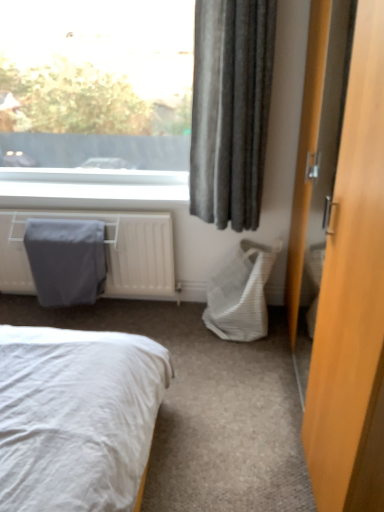
Identify the location of dark grey fabric curtain at upper right. The width and height of the screenshot is (384, 512). (231, 109).

Measure the distance between white woven laundry basket at lower right and camera.

white woven laundry basket at lower right and camera are 2.32 meters apart from each other.

What do you see at coordinates (66, 260) in the screenshot? Image resolution: width=384 pixels, height=512 pixels. I see `gray fabric blanket at left` at bounding box center [66, 260].

The image size is (384, 512). What do you see at coordinates (352, 298) in the screenshot? I see `wooden door at right` at bounding box center [352, 298].

At what (x,y) coordinates should I click in order to perform the action: click on dark grey fabric curtain at upper right. Please return your answer as a coordinate pair (x, y). Looking at the image, I should click on (231, 109).

Is dark grey fabric curtain at upper right aimed at wooden door at right?

No, dark grey fabric curtain at upper right is not turned towards wooden door at right.

At what (x,y) coordinates should I click in order to perform the action: click on door in front of the dark grey fabric curtain at upper right. Please return your answer as a coordinate pair (x, y). The width and height of the screenshot is (384, 512). Looking at the image, I should click on (352, 298).

Which object is wider, dark grey fabric curtain at upper right or wooden door at right?

With larger width is wooden door at right.

Which object is positioned more to the right, dark grey fabric curtain at upper right or wooden door at right?

From the viewer's perspective, wooden door at right appears more on the right side.

Considering the positions of objects wooden door at right and dark grey fabric curtain at upper right in the image provided, who is behind, wooden door at right or dark grey fabric curtain at upper right?

dark grey fabric curtain at upper right.

Based on the photo, can you confirm if wooden door at right is bigger than dark grey fabric curtain at upper right?

Correct, wooden door at right is larger in size than dark grey fabric curtain at upper right.

Are wooden door at right and dark grey fabric curtain at upper right beside each other?

They are not placed beside each other.

Consider the image. Is gray fabric blanket at left facing towards wooden door at right?

No, gray fabric blanket at left is not oriented towards wooden door at right.

Which of these two, gray fabric blanket at left or wooden door at right, is thinner?

gray fabric blanket at left is thinner.

From the image's perspective, which is below, gray fabric blanket at left or wooden door at right?

gray fabric blanket at left is shown below in the image.

Looking at the image, does gray fabric blanket at left seem bigger or smaller compared to wooden door at right?

In the image, gray fabric blanket at left appears to be smaller than wooden door at right.

Is point (225, 268) closer to viewer compared to point (352, 131)?

No.

Can you tell me how much white woven laundry basket at lower right and wooden door at right differ in facing direction?

There is a 94.4-degree angle between the facing directions of white woven laundry basket at lower right and wooden door at right.

From a real-world perspective, relative to wooden door at right, is white woven laundry basket at lower right vertically above or below?

white woven laundry basket at lower right is below wooden door at right.

Is the depth of white woven laundry basket at lower right greater than that of wooden door at right?

Yes, it is behind wooden door at right.

What's the angular difference between dark grey fabric curtain at upper right and gray fabric-covered radiator at left's facing directions?

dark grey fabric curtain at upper right and gray fabric-covered radiator at left are facing 0.705 degrees away from each other.

Which object is thinner, dark grey fabric curtain at upper right or gray fabric-covered radiator at left?

dark grey fabric curtain at upper right.

Looking at this image, is dark grey fabric curtain at upper right in front of or behind gray fabric-covered radiator at left in the image?

Visually, dark grey fabric curtain at upper right is located in front of gray fabric-covered radiator at left.

Could you tell me if dark grey fabric curtain at upper right is turned towards gray fabric-covered radiator at left?

No, dark grey fabric curtain at upper right is not facing towards gray fabric-covered radiator at left.

From a real-world perspective, is wooden door at right positioned above or below gray fabric blanket at left?

In terms of real-world spatial position, wooden door at right is above gray fabric blanket at left.

How many degrees apart are the facing directions of wooden door at right and gray fabric blanket at left?

The angle between the facing direction of wooden door at right and the facing direction of gray fabric blanket at left is 92.4 degrees.

Considering the positions of point (365, 35) and point (74, 261), is point (365, 35) closer or farther from the camera than point (74, 261)?

Point (365, 35) is positioned closer to the camera compared to point (74, 261).

Could you tell me if wooden door at right is turned towards gray fabric blanket at left?

Yes, wooden door at right is aimed at gray fabric blanket at left.

Considering the positions of objects wooden door at right and white woven laundry basket at lower right in the image provided, who is behind, wooden door at right or white woven laundry basket at lower right?

white woven laundry basket at lower right is further from the camera.

Is wooden door at right oriented towards white woven laundry basket at lower right?

Yes, wooden door at right faces towards white woven laundry basket at lower right.

Can you confirm if wooden door at right is positioned to the right of white woven laundry basket at lower right?

Yes.

Image resolution: width=384 pixels, height=512 pixels. Find the location of `door that is in front of the dark grey fabric curtain at upper right`. door that is in front of the dark grey fabric curtain at upper right is located at coordinates click(352, 298).

You are a GUI agent. You are given a task and a screenshot of the screen. Output one action in this format:
    pyautogui.click(x=<x>, y=<y>)
    Task: Click on the door below the dark grey fabric curtain at upper right (from a real-world perspective)
    
    Given the screenshot: What is the action you would take?
    pyautogui.click(x=352, y=298)

Considering their positions, is gray fabric blanket at left positioned closer to wooden door at right than dark grey fabric curtain at upper right?

Among the two, dark grey fabric curtain at upper right is located nearer to wooden door at right.

Based on the photo, from the image, which object appears to be farther from dark grey fabric curtain at upper right, wooden door at right or gray fabric-covered radiator at left?

wooden door at right lies further to dark grey fabric curtain at upper right than the other object.

From the image, which object appears to be nearer to dark grey fabric curtain at upper right, gray fabric-covered radiator at left or white woven laundry basket at lower right?

white woven laundry basket at lower right is positioned closer to the anchor dark grey fabric curtain at upper right.

When comparing their distances from gray fabric blanket at left, does dark grey fabric curtain at upper right or gray fabric-covered radiator at left seem further?

dark grey fabric curtain at upper right.

Estimate the real-world distances between objects in this image. Which object is closer to wooden door at right, white woven laundry basket at lower right or dark grey fabric curtain at upper right?

dark grey fabric curtain at upper right is closer to wooden door at right.

Looking at the image, which one is located closer to white woven laundry basket at lower right, dark grey fabric curtain at upper right or gray fabric-covered radiator at left?

Based on the image, gray fabric-covered radiator at left appears to be nearer to white woven laundry basket at lower right.

Considering their positions, is white woven laundry basket at lower right positioned closer to gray fabric blanket at left than wooden door at right?

Based on the image, white woven laundry basket at lower right appears to be nearer to gray fabric blanket at left.

From the image, which object appears to be nearer to white woven laundry basket at lower right, gray fabric-covered radiator at left or wooden door at right?

gray fabric-covered radiator at left.

Locate an element on the screen. curtain located between wooden door at right and gray fabric blanket at left in the depth direction is located at coordinates (231, 109).

Where is `curtain between gray fabric blanket at left and white woven laundry basket at lower right`? curtain between gray fabric blanket at left and white woven laundry basket at lower right is located at coordinates [231, 109].

Locate an element on the screen. laundry basket between wooden door at right and gray fabric-covered radiator at left from front to back is located at coordinates (240, 292).

Where is `radiator positioned between wooden door at right and gray fabric blanket at left from near to far`? radiator positioned between wooden door at right and gray fabric blanket at left from near to far is located at coordinates (106, 252).